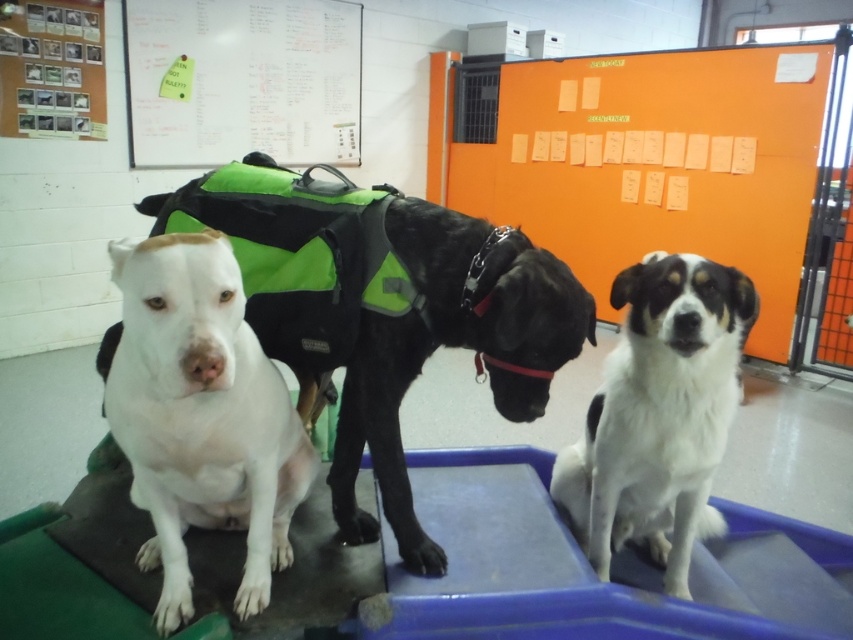
Find the location of a particular element. This screenshot has height=640, width=853. white matte dog at left is located at coordinates (399, 326).

Does white matte dog at left have a smaller size compared to white fur dog at left?

No, white matte dog at left is not smaller than white fur dog at left.

Which is in front, point (473, 248) or point (206, 448)?

Positioned in front is point (206, 448).

Find the location of a particular element. Image resolution: width=853 pixels, height=640 pixels. white matte dog at left is located at coordinates 399,326.

Who is shorter, white fur dog at left or whiteboard at upper center?

white fur dog at left

Who is higher up, white fur dog at left or whiteboard at upper center?

whiteboard at upper center

Does point (273, 563) lie behind point (358, 77)?

No.

The width and height of the screenshot is (853, 640). What are the coordinates of `white fur dog at left` in the screenshot? It's located at (201, 417).

Is point (662, 253) farther from viewer compared to point (140, 8)?

No, (662, 253) is closer to viewer.

Which is below, white fur dog at center or whiteboard at upper center?

white fur dog at center is below.

Who is more distant from viewer, (590, 564) or (270, 76)?

The point (270, 76) is more distant.

This screenshot has width=853, height=640. I want to click on white fur dog at center, so click(x=659, y=413).